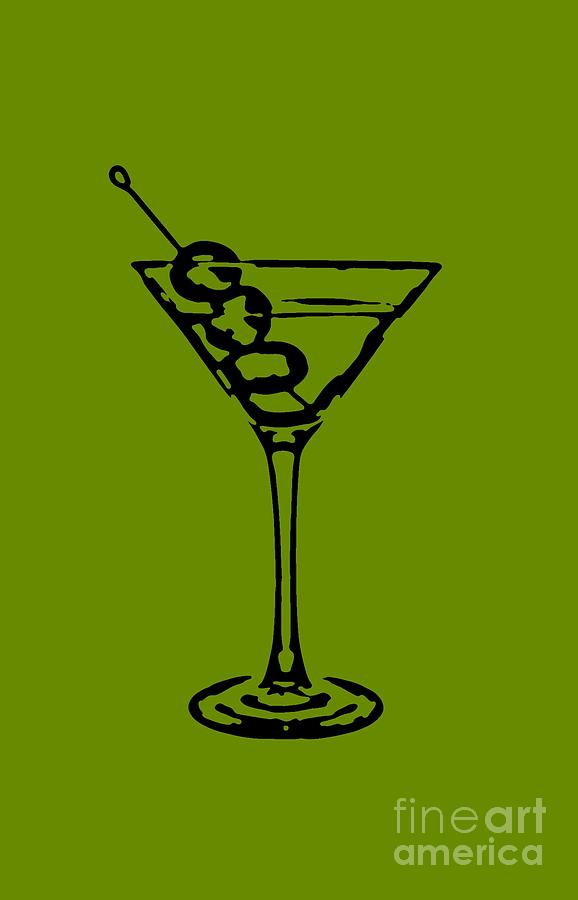
Where is `art`? This screenshot has height=900, width=578. art is located at coordinates (491, 828).